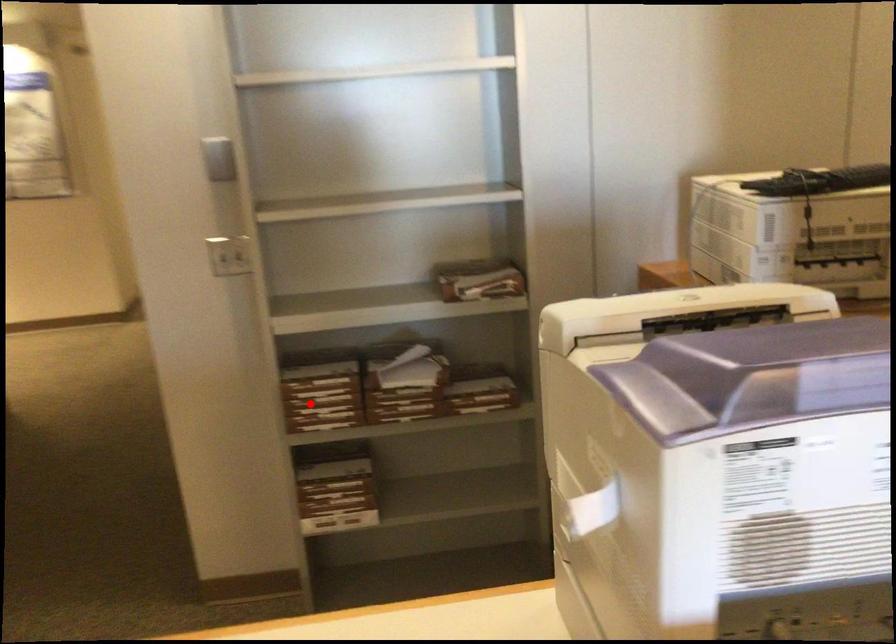
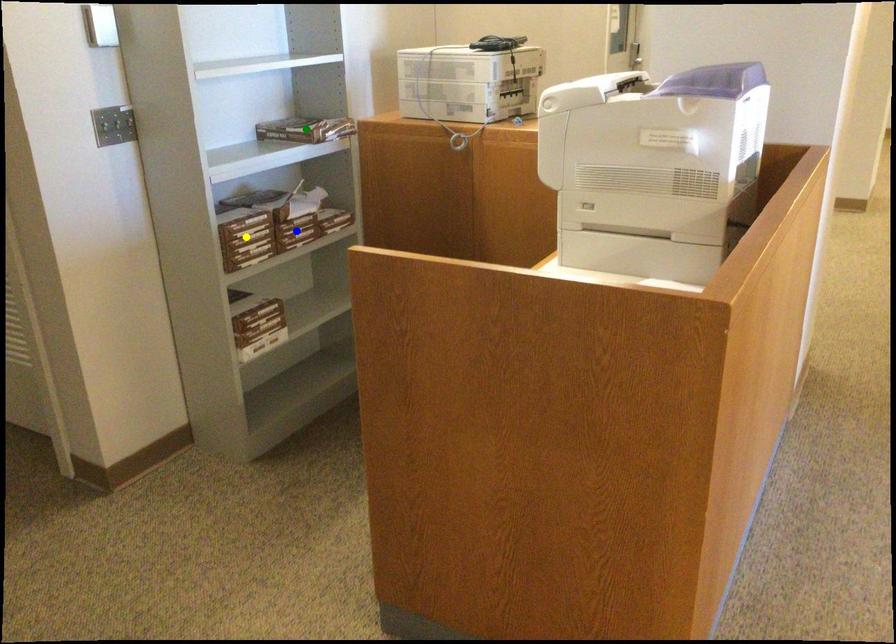
Question: I am providing you with two images of the same scene from different viewpoints. A red point is marked on the first image. You are given multiple points on the second image. Which point in image 2 represents the same 3d spot as the red point in image 1?

Choices:
 (A) blue point
 (B) yellow point
 (C) green point

Answer: (B)